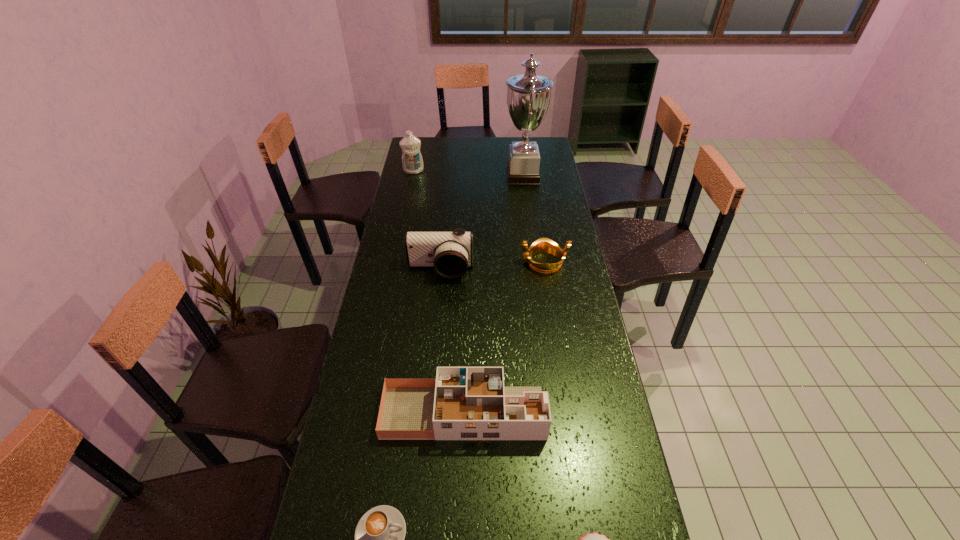
At what (x,y) coordinates should I click in order to perform the action: click on vacant space positioned at the front emblem of the tiara. Please return your answer as a coordinate pair (x, y). This screenshot has height=540, width=960. Looking at the image, I should click on (447, 262).

Locate an element on the screen. free space located at the front emblem of the tiara is located at coordinates (463, 262).

This screenshot has width=960, height=540. In order to click on free location located 0.350m at the front emblem of the tiara in this screenshot , I will do `click(429, 262)`.

Find the location of a particular element. free space located 0.190m at the front door of the dollhouse is located at coordinates (611, 413).

Find the location of a particular element. This screenshot has height=540, width=960. detergent that is at the left edge is located at coordinates (412, 162).

This screenshot has width=960, height=540. In order to click on camcorder that is at the left edge in this screenshot , I will do `click(450, 253)`.

Locate an element on the screen. Image resolution: width=960 pixels, height=540 pixels. dollhouse present at the left edge is located at coordinates (468, 403).

Locate an element on the screen. trophy cup located at the right edge is located at coordinates [528, 95].

Identify the location of tiara at the right edge. (543, 245).

You are a GUI agent. You are given a task and a screenshot of the screen. Output one action in this format:
    pyautogui.click(x=<x>, y=<y>)
    Task: Click on the vacant area at the far edge of the desktop
    This screenshot has height=540, width=960.
    Given the screenshot: What is the action you would take?
    pyautogui.click(x=468, y=154)